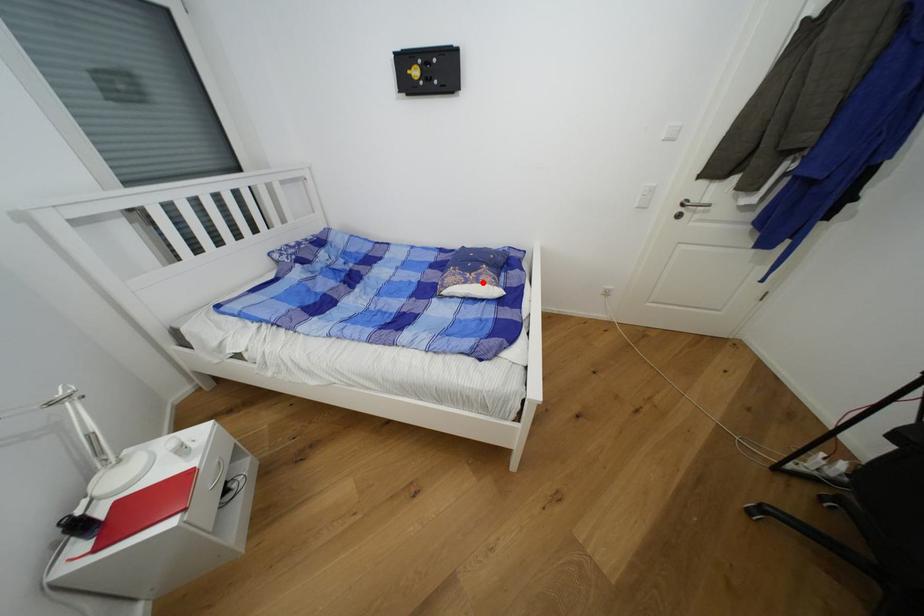
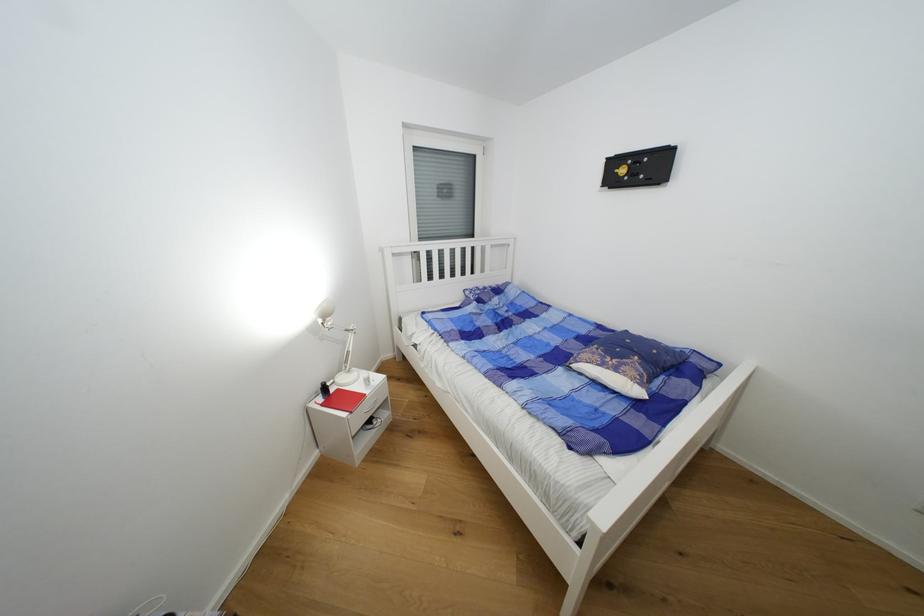
Find the pixel in the second image that matches the highlighted location in the first image.

(622, 371)